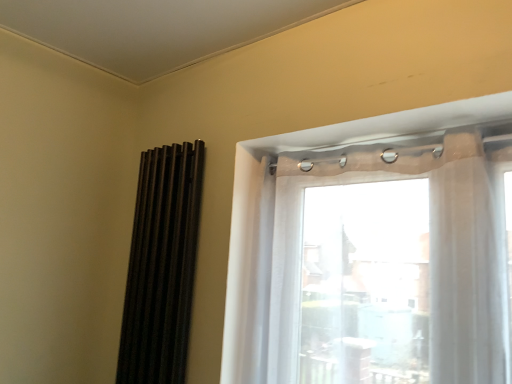
Question: From a real-world perspective, is black matte shutters at left over translucent fabric at upper right?

Choices:
 (A) yes
 (B) no

Answer: (B)

Question: Is black matte shutters at left to the left of translucent fabric at upper right from the viewer's perspective?

Choices:
 (A) no
 (B) yes

Answer: (B)

Question: Is black matte shutters at left in contact with translucent fabric at upper right?

Choices:
 (A) no
 (B) yes

Answer: (A)

Question: Is black matte shutters at left far from translucent fabric at upper right?

Choices:
 (A) yes
 (B) no

Answer: (B)

Question: Does black matte shutters at left have a greater width compared to translucent fabric at upper right?

Choices:
 (A) yes
 (B) no

Answer: (B)

Question: Is black matte shutters at left further to camera compared to translucent fabric at upper right?

Choices:
 (A) no
 (B) yes

Answer: (B)

Question: Is translucent fabric at upper right directly adjacent to black matte shutters at left?

Choices:
 (A) no
 (B) yes

Answer: (A)

Question: From a real-world perspective, is translucent fabric at upper right over black matte shutters at left?

Choices:
 (A) no
 (B) yes

Answer: (B)

Question: Can you confirm if translucent fabric at upper right is positioned to the right of black matte shutters at left?

Choices:
 (A) yes
 (B) no

Answer: (A)

Question: From the image's perspective, is translucent fabric at upper right on top of black matte shutters at left?

Choices:
 (A) no
 (B) yes

Answer: (B)

Question: Considering the relative sizes of translucent fabric at upper right and black matte shutters at left in the image provided, is translucent fabric at upper right thinner than black matte shutters at left?

Choices:
 (A) yes
 (B) no

Answer: (B)

Question: Is translucent fabric at upper right not inside black matte shutters at left?

Choices:
 (A) yes
 (B) no

Answer: (A)

Question: In the image, is black matte shutters at left positioned in front of or behind translucent fabric at upper right?

Choices:
 (A) front
 (B) behind

Answer: (B)